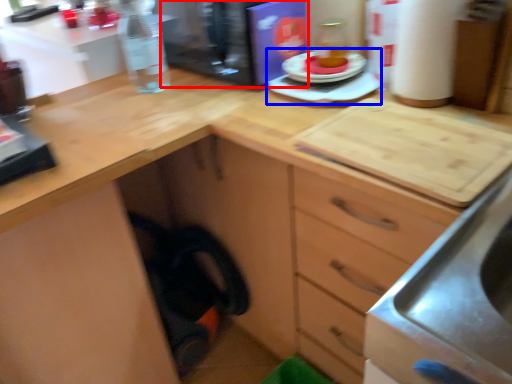
Question: Among these objects, which one is nearest to the camera, appliance (highlighted by a red box) or appliance (highlighted by a blue box)?

Choices:
 (A) appliance
 (B) appliance

Answer: (B)